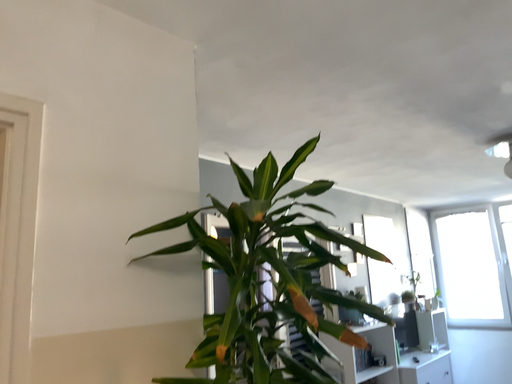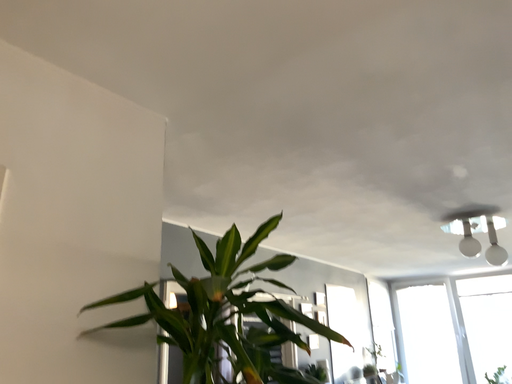
Question: Which way did the camera rotate in the video?

Choices:
 (A) rotated downward
 (B) rotated upward

Answer: (B)